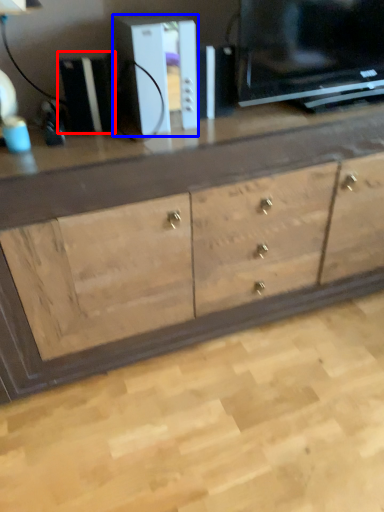
Question: Which point is closer to the camera, appliance (highlighted by a red box) or appliance (highlighted by a blue box)?

Choices:
 (A) appliance
 (B) appliance

Answer: (B)